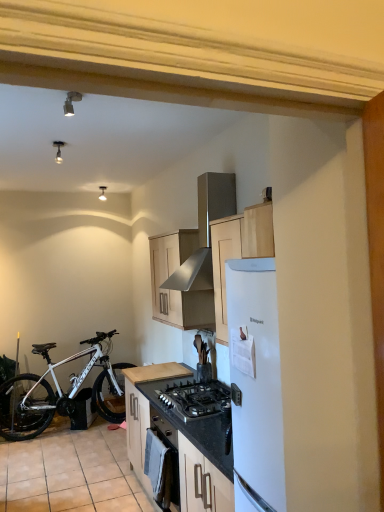
Question: Is stainless steel range hood at upper center oriented towards black matte gas stove at center?

Choices:
 (A) no
 (B) yes

Answer: (A)

Question: From the image's perspective, is stainless steel range hood at upper center on top of black matte gas stove at center?

Choices:
 (A) no
 (B) yes

Answer: (B)

Question: From a real-world perspective, is stainless steel range hood at upper center physically above black matte gas stove at center?

Choices:
 (A) yes
 (B) no

Answer: (A)

Question: From the image's perspective, does stainless steel range hood at upper center appear lower than black matte gas stove at center?

Choices:
 (A) no
 (B) yes

Answer: (A)

Question: Can you confirm if stainless steel range hood at upper center is positioned to the right of black matte gas stove at center?

Choices:
 (A) no
 (B) yes

Answer: (A)

Question: Is stainless steel range hood at upper center wider than black matte gas stove at center?

Choices:
 (A) no
 (B) yes

Answer: (A)

Question: From the image's perspective, is white matte bicycle at lower left beneath light wood cabinet at center, which is the 2th cabinetry from top to bottom?

Choices:
 (A) yes
 (B) no

Answer: (A)

Question: Is white matte bicycle at lower left placed right next to light wood cabinet at center, which is the 2th cabinetry from top to bottom?

Choices:
 (A) no
 (B) yes

Answer: (A)

Question: Can you confirm if white matte bicycle at lower left is shorter than light wood cabinet at center, marked as the 1th cabinetry in a bottom-to-top arrangement?

Choices:
 (A) yes
 (B) no

Answer: (B)

Question: Is white matte bicycle at lower left positioned far away from light wood cabinet at center, which is the 2th cabinetry from top to bottom?

Choices:
 (A) yes
 (B) no

Answer: (A)

Question: Is white matte bicycle at lower left positioned with its back to light wood cabinet at center, which is the 2th cabinetry from top to bottom?

Choices:
 (A) no
 (B) yes

Answer: (A)

Question: Does white matte bicycle at lower left have a smaller size compared to light wood cabinet at center, marked as the 1th cabinetry in a bottom-to-top arrangement?

Choices:
 (A) no
 (B) yes

Answer: (A)

Question: Can you confirm if beige tile at lower left is smaller than white matte bicycle at lower left?

Choices:
 (A) no
 (B) yes

Answer: (B)